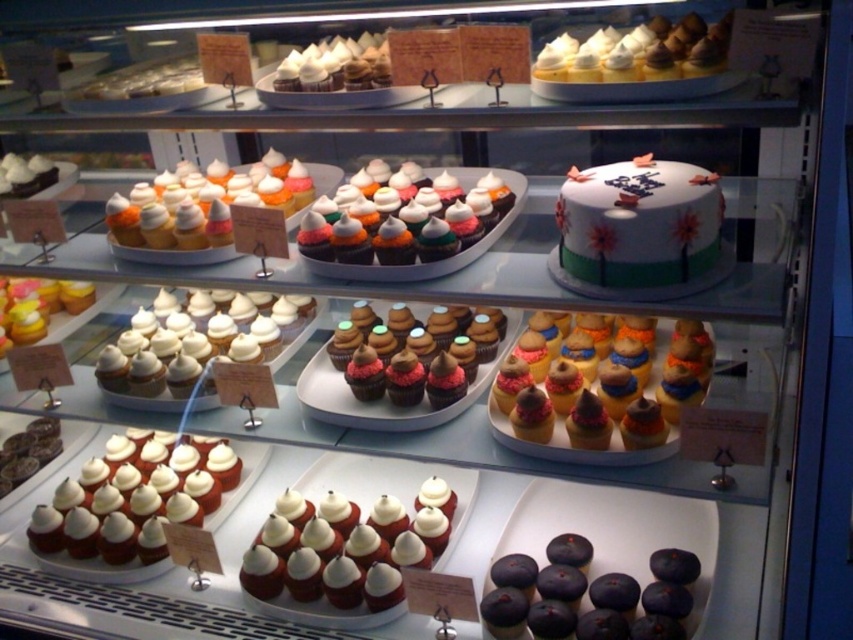
Based on the photo, can you confirm if chocolate frosted cupcake at center is shorter than chocolate glazed donut at lower left?

No.

Is chocolate frosted cupcake at center further to the viewer compared to chocolate glazed donut at lower left?

No.

Where is `chocolate frosted cupcake at center`? This screenshot has width=853, height=640. chocolate frosted cupcake at center is located at coordinates (438, 358).

Is white frosted cupcake at lower left shorter than white meringue-topped cupcakes at upper center?

In fact, white frosted cupcake at lower left may be taller than white meringue-topped cupcakes at upper center.

Identify the location of white frosted cupcake at lower left. The height and width of the screenshot is (640, 853). (148, 502).

At what (x,y) coordinates should I click in order to perform the action: click on white frosted cupcake at lower left. Please return your answer as a coordinate pair (x, y). The height and width of the screenshot is (640, 853). Looking at the image, I should click on (148, 502).

Does chocolate frosted cupcake at center have a lesser height compared to matte chocolate cupcake at center?

Indeed, chocolate frosted cupcake at center has a lesser height compared to matte chocolate cupcake at center.

Does point (401, 388) lie behind point (512, 352)?

No, (401, 388) is in front of (512, 352).

Find the location of a particular element. This screenshot has height=640, width=853. chocolate frosted cupcake at center is located at coordinates (438, 358).